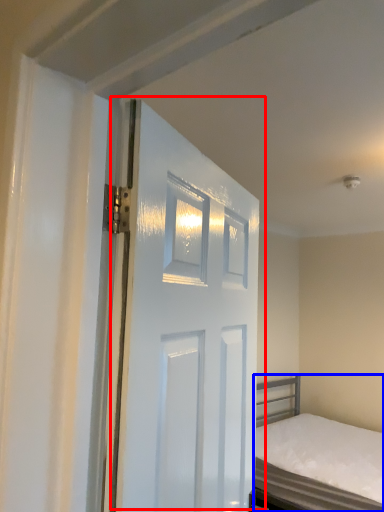
Question: Which of the following is the closest to the observer, door (highlighted by a red box) or bed (highlighted by a blue box)?

Choices:
 (A) door
 (B) bed

Answer: (A)